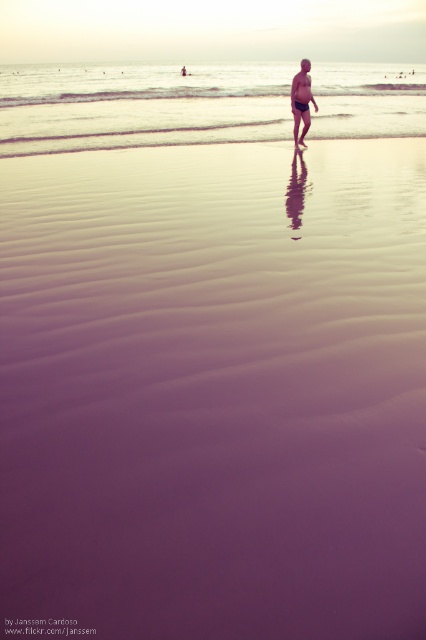
Who is more distant from viewer, (74,90) or (293,129)?

Point (74,90)

Does clear water at center appear under matte black swim trunks at center?

Incorrect, clear water at center is not positioned below matte black swim trunks at center.

Which is in front, point (112, 96) or point (313, 104)?

Point (313, 104) is in front.

I want to click on clear water at center, so click(x=141, y=106).